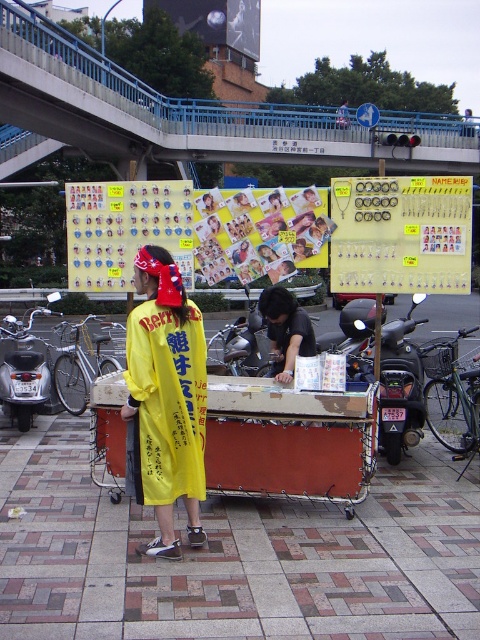
Can you confirm if brick pavement at center is thinner than silver metallic motorcycle at left?

In fact, brick pavement at center might be wider than silver metallic motorcycle at left.

Is brick pavement at center behind silver metallic motorcycle at left?

No.

At what (x,y) coordinates should I click in order to perform the action: click on brick pavement at center. Please return your answer as a coordinate pair (x, y). The width and height of the screenshot is (480, 640). Looking at the image, I should click on (235, 554).

Find the location of `brick pavement at center`. brick pavement at center is located at coordinates (235, 554).

Can you confirm if brick pavement at center is positioned to the right of yellow fabric shirt at center?

Yes, brick pavement at center is to the right of yellow fabric shirt at center.

Does brick pavement at center have a greater height compared to yellow fabric shirt at center?

Incorrect, brick pavement at center's height is not larger of yellow fabric shirt at center's.

Is point (78, 545) closer to camera compared to point (178, 342)?

No, it is behind (178, 342).

Where is `brick pavement at center`? This screenshot has height=640, width=480. brick pavement at center is located at coordinates (x=235, y=554).

Measure the distance between point (183, 321) and camera.

They are 4.36 meters apart.

Is point (192, 509) farther from viewer compared to point (7, 374)?

No, it is in front of (7, 374).

Measure the distance between point (x=157, y=476) and camera.

Point (x=157, y=476) is 4.34 meters away from camera.

Image resolution: width=480 pixels, height=640 pixels. What are the coordinates of `yellow fabric shirt at center` in the screenshot? It's located at (166, 397).